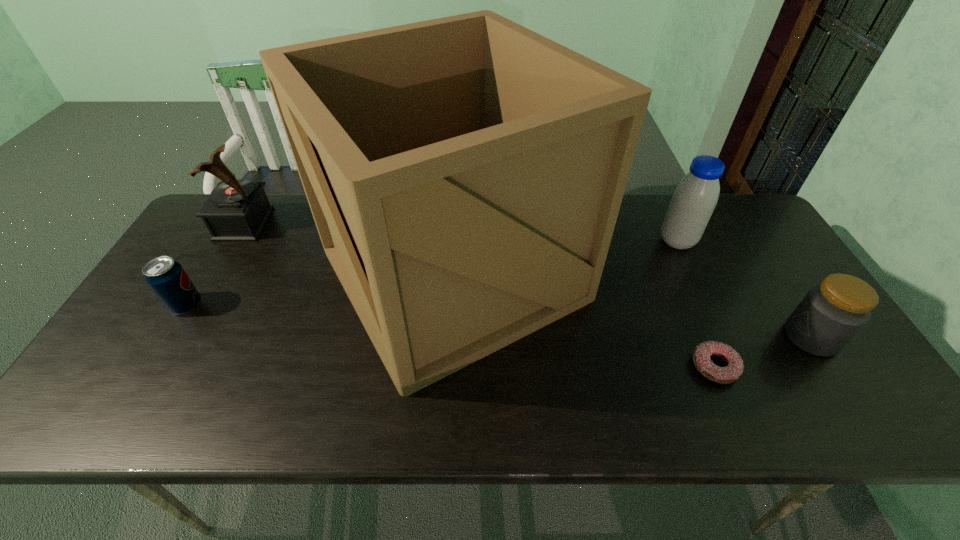
You are a GUI agent. You are given a task and a screenshot of the screen. Output one action in this format:
    pyautogui.click(x=<x>, y=<y>)
    Task: Click on the phonograph_record present at the left edge
    Image resolution: width=960 pixels, height=540 pixels.
    Given the screenshot: What is the action you would take?
    pyautogui.click(x=237, y=210)

Locate an element on the screen. soda can present at the left edge is located at coordinates (167, 279).

Identify the location of object that is positioned at the right edge. This screenshot has width=960, height=540. (831, 314).

The height and width of the screenshot is (540, 960). In order to click on object that is at the far left corner in this screenshot , I will do `click(237, 210)`.

Find the location of a particular element. This screenshot has width=960, height=540. free spot at the far edge of the desktop is located at coordinates coord(280,205).

Find the location of a particular element. The width and height of the screenshot is (960, 540). free spot at the near edge of the desktop is located at coordinates (557, 427).

In the image, there is a desktop. Where is `free space at the left edge`? The image size is (960, 540). free space at the left edge is located at coordinates coord(188,334).

Locate an element on the screen. The height and width of the screenshot is (540, 960). vacant space at the right edge of the desktop is located at coordinates (760, 261).

Image resolution: width=960 pixels, height=540 pixels. I want to click on blank space at the far right corner, so point(717,220).

Locate an element on the screen. The width and height of the screenshot is (960, 540). vacant space that is in between the third object from left to right and the shortest object is located at coordinates (584, 320).